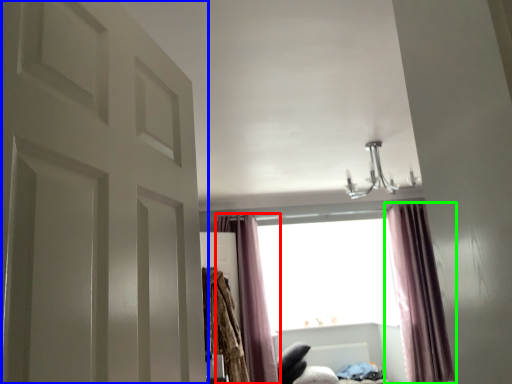
Question: Which object is positioned closest to curtain (highlighted by a red box)? Select from door (highlighted by a blue box) and curtain (highlighted by a green box).

Choices:
 (A) door
 (B) curtain

Answer: (B)